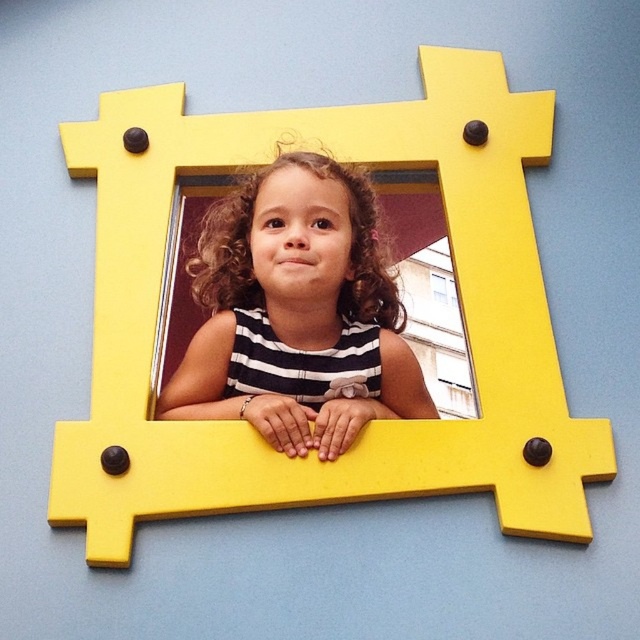
You are an architect designing a new building and need to place two points on a wall. The first point is at coordinates point (381, 291) and the second is at point (433, 276). Based on the scene description, which point is closer to the viewer?

Point (381, 291) is closer to the viewer than point (433, 276).

You are a photographer trying to capture a portrait of the child. The child is wearing a black striped shirt at center and standing in front of a transparent glass window at center. To avoid reflections on the window, where should the photographer position themselves relative to the child?

The photographer should position themselves closer to the black striped shirt at center than the transparent glass window at center to minimize reflections on the window.

You are a photographer trying to capture the child in the scene. If you want to focus on the black striped shirt at center without the transparent glass window at center being in the shot, where should you position your camera relative to the child?

The black striped shirt at center is below the transparent glass window at center, so you should position your camera below the child to avoid capturing the transparent glass window at center in the shot.